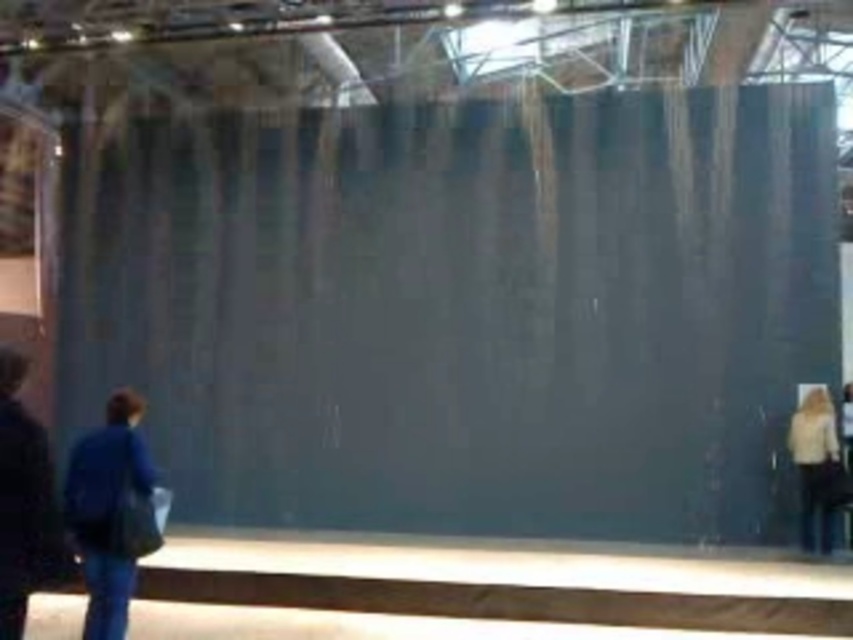
You are an event organizer setting up a booth in the gallery. You need to place a rectangular sign that is 2 feet wide between the blue fabric bag at lower left and the light beige sweater at lower right. Based on their widths, can the sign fit between them without overlapping either object?

The blue fabric bag at lower left might be wider than light beige sweater at lower right, so the sign might not fit between them if the total width of both objects exceeds 2 feet. However, since the exact widths aren not provided, it is uncertain.

You are an event planner arranging a photo shoot in the gallery. You need to position a tall tripod between the dark blue jacket at left and the blue fabric bag at lower left. Which object should the tripod be placed closer to to ensure it doesn

The dark blue jacket at left has a lesser height compared to the blue fabric bag at lower left. To ensure the tripod can be positioned between them without obstructing the view of the taller object, the tripod should be placed closer to the dark blue jacket at left.